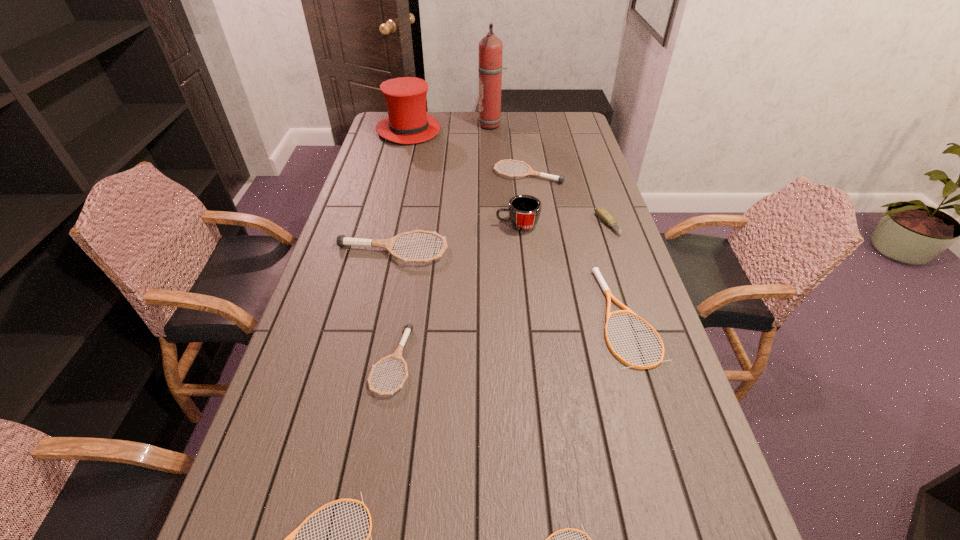
Locate an element on the screen. red fire extinguisher is located at coordinates (490, 67).

I want to click on fire extinguisher, so click(490, 67).

Where is `the second tallest object`? Image resolution: width=960 pixels, height=540 pixels. the second tallest object is located at coordinates (408, 122).

Identify the location of hat. (408, 122).

In order to click on red mug in this screenshot , I will do `click(524, 211)`.

Image resolution: width=960 pixels, height=540 pixels. In order to click on the eighth shortest object in this screenshot , I will do `click(524, 211)`.

Find the location of `the fifth nearest tennis racket`. the fifth nearest tennis racket is located at coordinates (342, 240).

Where is `the fourth tallest object`? the fourth tallest object is located at coordinates (342, 240).

Where is `the second smallest gray tennis racket`? This screenshot has width=960, height=540. the second smallest gray tennis racket is located at coordinates (560, 179).

The image size is (960, 540). I want to click on the farthest gray tennis racket, so click(560, 179).